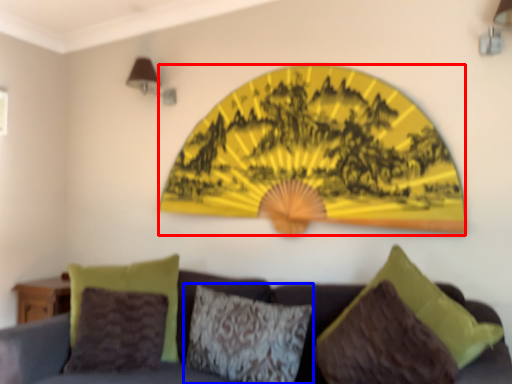
Question: Which object is further to the camera taking this photo, design (highlighted by a red box) or pillow (highlighted by a blue box)?

Choices:
 (A) design
 (B) pillow

Answer: (A)